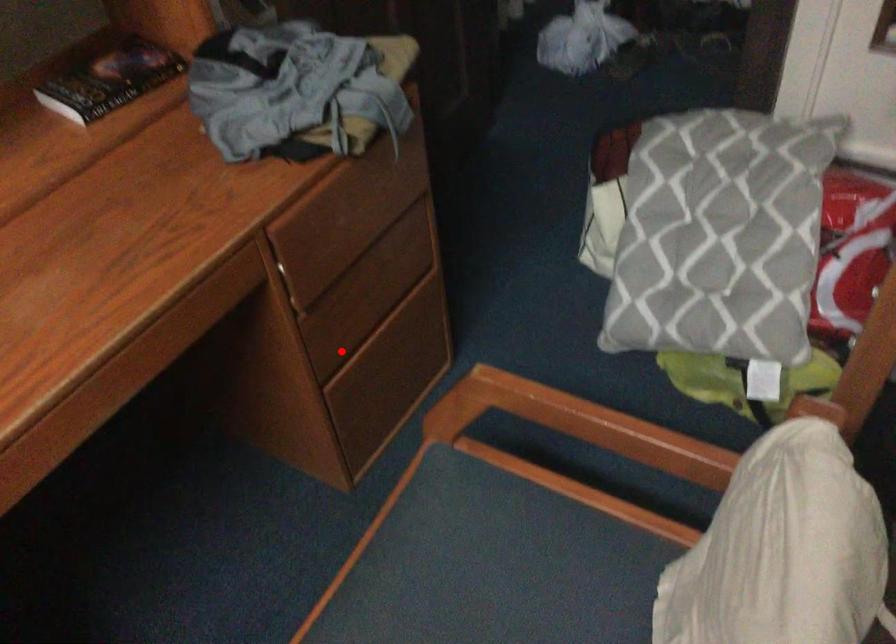
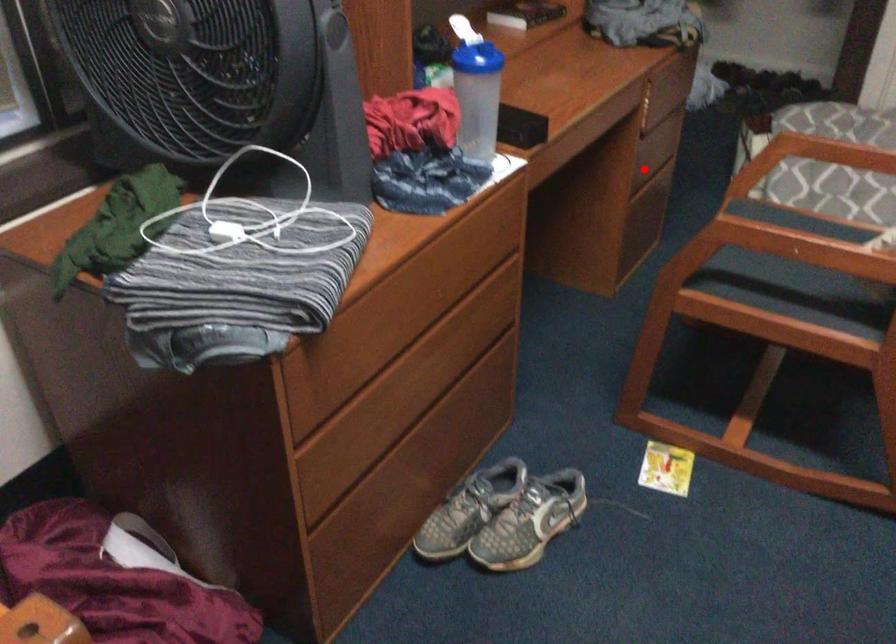
I am providing you with two images of the same scene from different viewpoints. A red point is marked on the first image and another point is marked on the second image. Is the red point in image1 aligned with the point shown in image2?

Yes